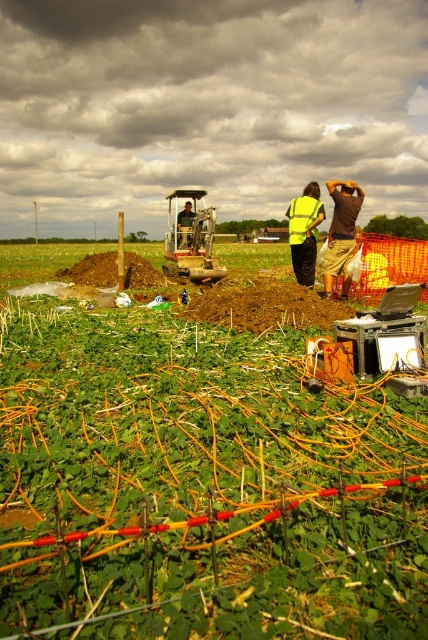
You are a construction worker standing at the edge of the field. You notice a metallic yellow tractor at center and a green reflective vest at center. Which object is closer to you?

The metallic yellow tractor at center is closer to you because the green reflective vest at center is behind it.

You are a construction worker who needs to retrieve your high visibility yellow vest at center. The metallic yellow tractor at center is blocking your path. Can you move the tractor to access your vest?

The metallic yellow tractor at center is positioned over high visibility yellow vest at center, so you would need to move the tractor to access the vest.

You are standing at the entrance of the construction site and see the metallic yellow tractor at center. If you walk straight ahead from your current position, will you encounter the tractor before reaching the orange cables spread across the ground?

The metallic yellow tractor at center is located at point (190,240). Since the tractor is positioned closer to the entrance compared to the orange cables, walking straight ahead would lead you to the tractor before reaching the cables.